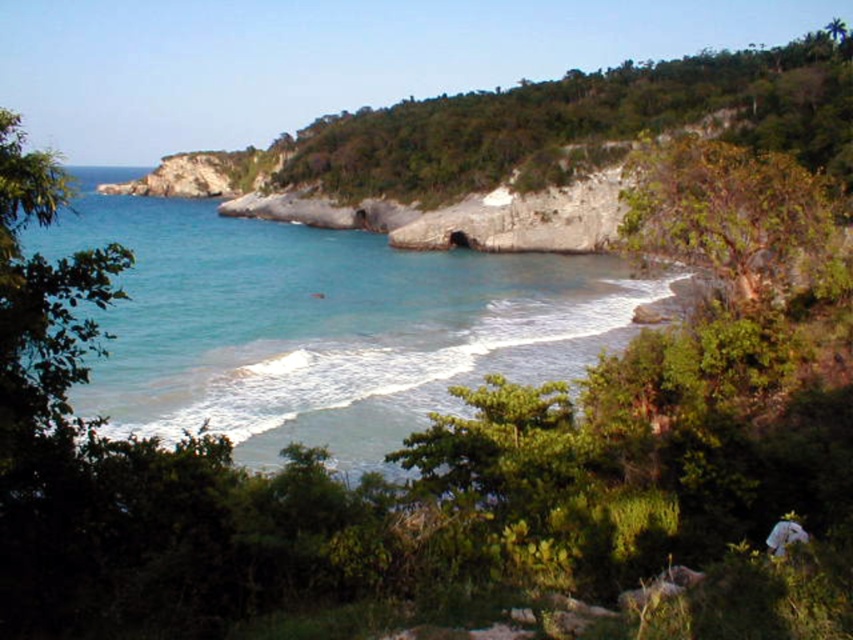
Question: Does clear blue water at center appear under green leafy hillside at upper center?

Choices:
 (A) yes
 (B) no

Answer: (A)

Question: Can you confirm if clear blue water at center is positioned above green leafy hillside at upper center?

Choices:
 (A) yes
 (B) no

Answer: (B)

Question: Which object is closer to the camera taking this photo?

Choices:
 (A) clear blue water at center
 (B) green leafy hillside at upper center

Answer: (A)

Question: Among these points, which one is farthest from the camera?

Choices:
 (A) (561, 225)
 (B) (593, 320)

Answer: (A)

Question: Does clear blue water at center have a greater width compared to green leafy hillside at upper center?

Choices:
 (A) yes
 (B) no

Answer: (B)

Question: Among these points, which one is nearest to the camera?

Choices:
 (A) (595, 269)
 (B) (498, 209)

Answer: (A)